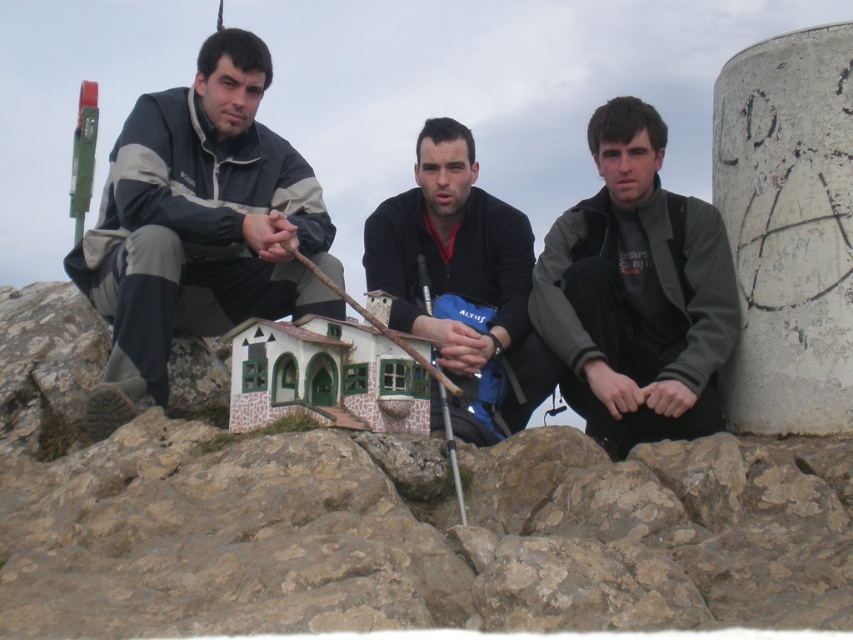
Is matte gray jacket at left to the right of dark gray jacket at center from the viewer's perspective?

Incorrect, matte gray jacket at left is not on the right side of dark gray jacket at center.

Can you confirm if matte gray jacket at left is thinner than dark gray jacket at center?

No, matte gray jacket at left is not thinner than dark gray jacket at center.

Identify the location of matte gray jacket at left. (198, 227).

This screenshot has height=640, width=853. I want to click on matte gray jacket at left, so pyautogui.click(x=198, y=227).

Measure the distance between point (119,291) and camera.

Point (119,291) is 214.66 feet away from camera.

Identify the location of matte gray jacket at left. Image resolution: width=853 pixels, height=640 pixels. (198, 227).

Does point (718, 92) come closer to viewer compared to point (567, 296)?

Yes, it is.

Between white concrete pillar at upper right and dark gray jacket at center, which one appears on the left side from the viewer's perspective?

From the viewer's perspective, dark gray jacket at center appears more on the left side.

Find the location of `white concrete pillar at upper right`. white concrete pillar at upper right is located at coordinates (788, 228).